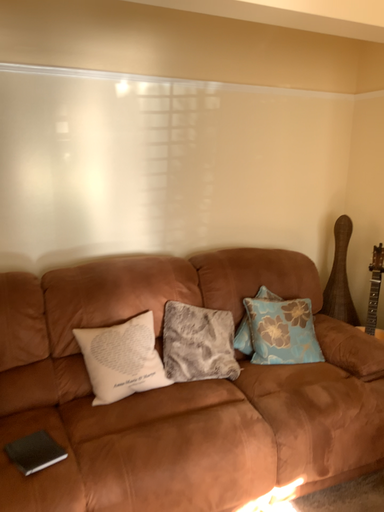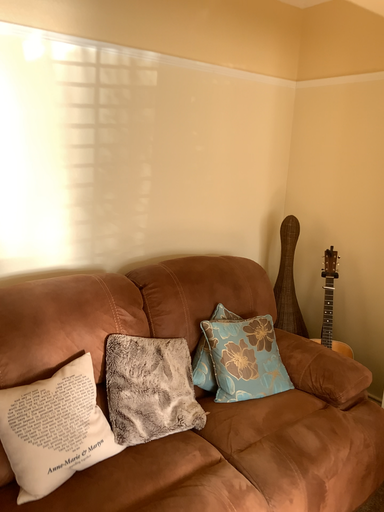
Question: Which way did the camera rotate in the video?

Choices:
 (A) rotated right
 (B) rotated left

Answer: (A)